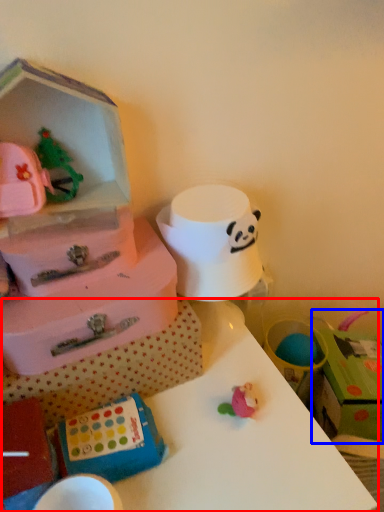
Question: Which object is further to the camera taking this photo, table (highlighted by a red box) or storage box (highlighted by a blue box)?

Choices:
 (A) table
 (B) storage box

Answer: (B)